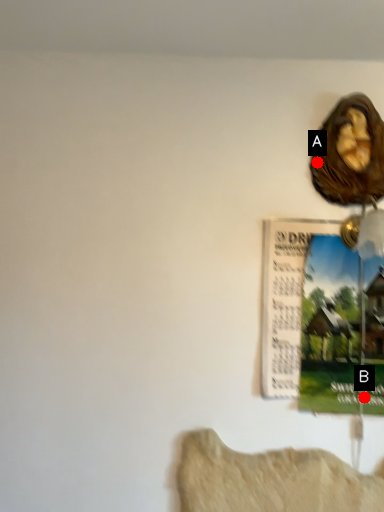
Question: Two points are circled on the image, labeled by A and B beside each circle. Among these points, which one is nearest to the camera?

Choices:
 (A) A is closer
 (B) B is closer

Answer: (B)